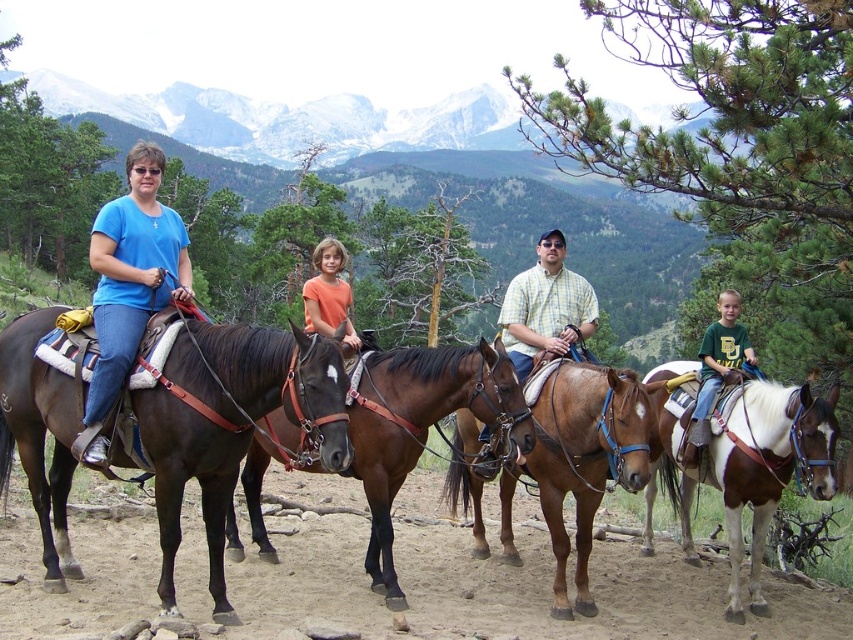
Is point (424, 406) farther from viewer compared to point (117, 237)?

Yes.

Who is more forward, (375, 522) or (125, 353)?

Point (125, 353) is more forward.

Identify the location of brown leather horse at center. Image resolution: width=853 pixels, height=640 pixels. (419, 424).

Describe the element at coordinates (419, 424) in the screenshot. Image resolution: width=853 pixels, height=640 pixels. I see `brown leather horse at center` at that location.

Which is in front, point (370, 547) or point (305, 296)?

Positioned in front is point (370, 547).

This screenshot has height=640, width=853. Find the location of `brown leather horse at center`. brown leather horse at center is located at coordinates (419, 424).

Can you confirm if brown glossy horse at center is thinner than orange matte shirt at center?

Yes, brown glossy horse at center is thinner than orange matte shirt at center.

Who is more distant from viewer, (633, 403) or (328, 244)?

The point (328, 244) is behind.

Which is behind, point (521, 472) or point (344, 256)?

The point (344, 256) is behind.

Identify the location of brown glossy horse at center. (579, 460).